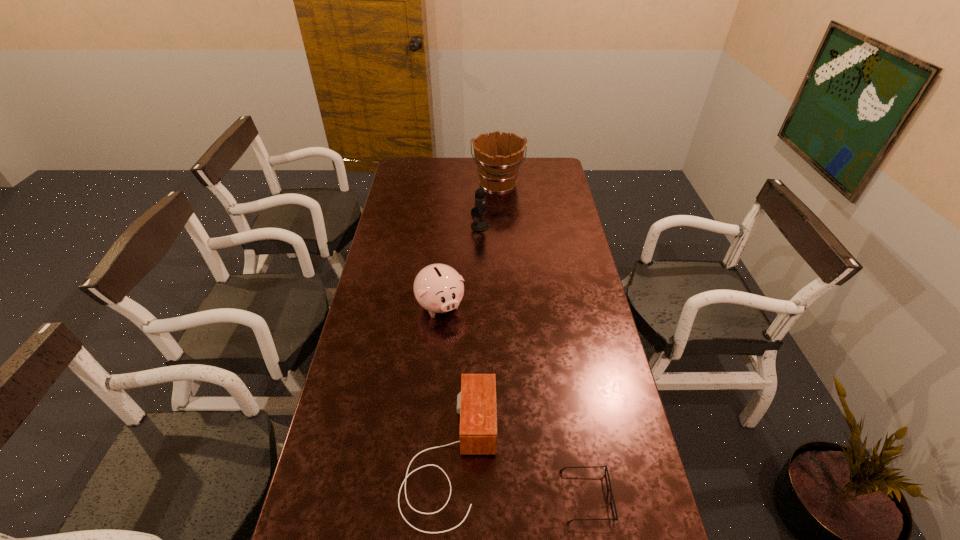
You are a GUI agent. You are given a task and a screenshot of the screen. Output one action in this format:
    pyautogui.click(x=<x>, y=<y>)
    Task: Click on the free space between the wine bucket and the fourth nearest object
    This screenshot has width=960, height=540.
    Given the screenshot: What is the action you would take?
    pyautogui.click(x=489, y=205)

You are a GUI agent. You are given a task and a screenshot of the screen. Output one action in this format:
    pyautogui.click(x=<x>, y=<y>)
    Task: Click on the vacant area between the second shortest object and the spectacles
    The height and width of the screenshot is (540, 960).
    Given the screenshot: What is the action you would take?
    pyautogui.click(x=518, y=476)

In order to click on free area in between the spectacles and the piggy bank in this screenshot , I will do `click(514, 401)`.

Where is `blank region between the microphone and the spectacles`? The height and width of the screenshot is (540, 960). blank region between the microphone and the spectacles is located at coordinates (533, 361).

What are the coordinates of `vacant area between the second shortest object and the tallest object` in the screenshot? It's located at (474, 320).

You are a GUI agent. You are given a task and a screenshot of the screen. Output one action in this format:
    pyautogui.click(x=<x>, y=<y>)
    Task: Click on the free space that is in between the third nearest object and the microphone
    The image size is (960, 540).
    Given the screenshot: What is the action you would take?
    pyautogui.click(x=460, y=266)

Choose which object is the fourth nearest neighbor to the farthest object. Please provide its 2D coordinates. Your answer should be formatted as a tuple, i.e. [(x, y)], where the tuple contains the x and y coordinates of a point satisfying the conditions above.

[(615, 518)]

Locate which object is the closest to the spectacles. Please provide its 2D coordinates. Your answer should be formatted as a tuple, i.e. [(x, y)], where the tuple contains the x and y coordinates of a point satisfying the conditions above.

[(476, 403)]

You are a GUI agent. You are given a task and a screenshot of the screen. Output one action in this format:
    pyautogui.click(x=<x>, y=<y>)
    Task: Click on the vacant space that satisfies the following two spatial constraints: 1. on the back side of the microphone; 2. on the left side of the piggy bank
    The image size is (960, 540).
    Given the screenshot: What is the action you would take?
    pyautogui.click(x=447, y=226)